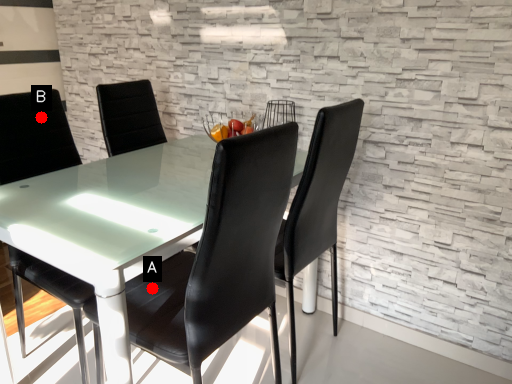
Question: Two points are circled on the image, labeled by A and B beside each circle. Among these points, which one is farthest from the camera?

Choices:
 (A) A is further
 (B) B is further

Answer: (B)